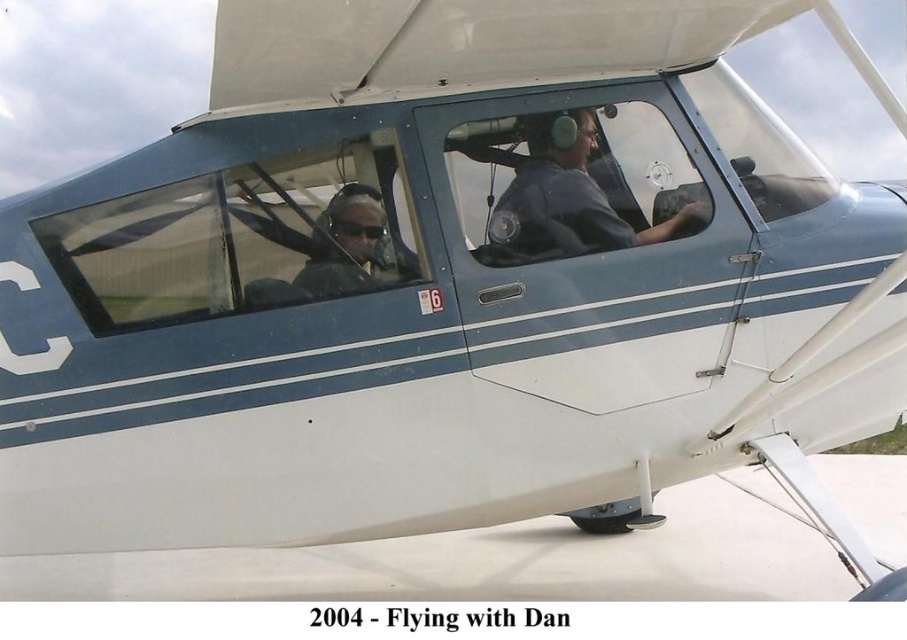
Can you confirm if matte black sunglasses at center is bigger than matte black cockpit at center?

Indeed, matte black sunglasses at center has a larger size compared to matte black cockpit at center.

Who is more distant from viewer, (367, 211) or (592, 134)?

The point (592, 134) is behind.

Who is more forward, (362, 236) or (595, 138)?

Point (362, 236) is more forward.

Locate an element on the screen. matte black sunglasses at center is located at coordinates 345,244.

Does matte blue shirt at center lie behind matte black nose at center?

Yes, it is.

Can you confirm if matte blue shirt at center is thinner than matte black nose at center?

No.

Who is more distant from viewer, (x=574, y=109) or (x=369, y=250)?

The point (x=574, y=109) is behind.

Locate an element on the screen. The width and height of the screenshot is (907, 640). matte blue shirt at center is located at coordinates (567, 202).

Can you confirm if matte black nose at center is thinner than matte black cockpit at center?

In fact, matte black nose at center might be wider than matte black cockpit at center.

Between point (367, 227) and point (593, 148), which one is positioned behind?

The point (593, 148) is more distant.

Find the location of a particular element. This screenshot has height=640, width=907. matte black nose at center is located at coordinates (371, 234).

What are the coordinates of `matte black nose at center` in the screenshot? It's located at (371, 234).